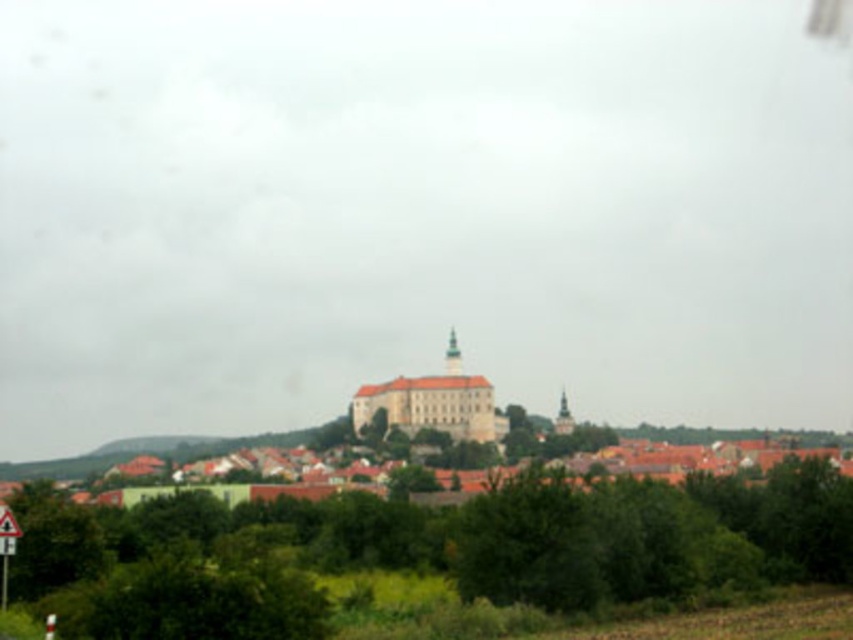
Question: In this image, where is white stone town at center located relative to white plastic triangle at lower left?

Choices:
 (A) below
 (B) above

Answer: (B)

Question: Does white stone town at center have a greater width compared to white plastic triangle at lower left?

Choices:
 (A) yes
 (B) no

Answer: (A)

Question: In this image, where is white stone town at center located relative to white plastic triangle at lower left?

Choices:
 (A) left
 (B) right

Answer: (B)

Question: Among these points, which one is nearest to the camera?

Choices:
 (A) (9, 547)
 (B) (454, 337)

Answer: (A)